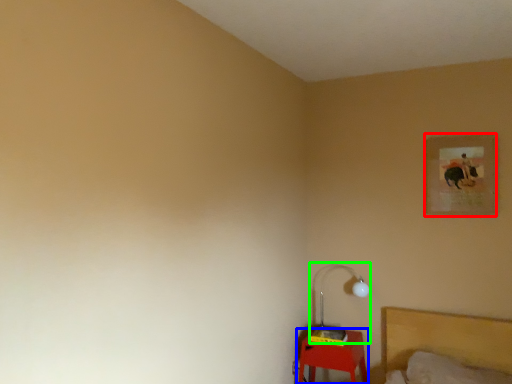
Question: Estimate the real-world distances between objects in this image. Which object is farther from picture frame (highlighted by a red box), furniture (highlighted by a blue box) or lamp (highlighted by a green box)?

Choices:
 (A) furniture
 (B) lamp

Answer: (A)